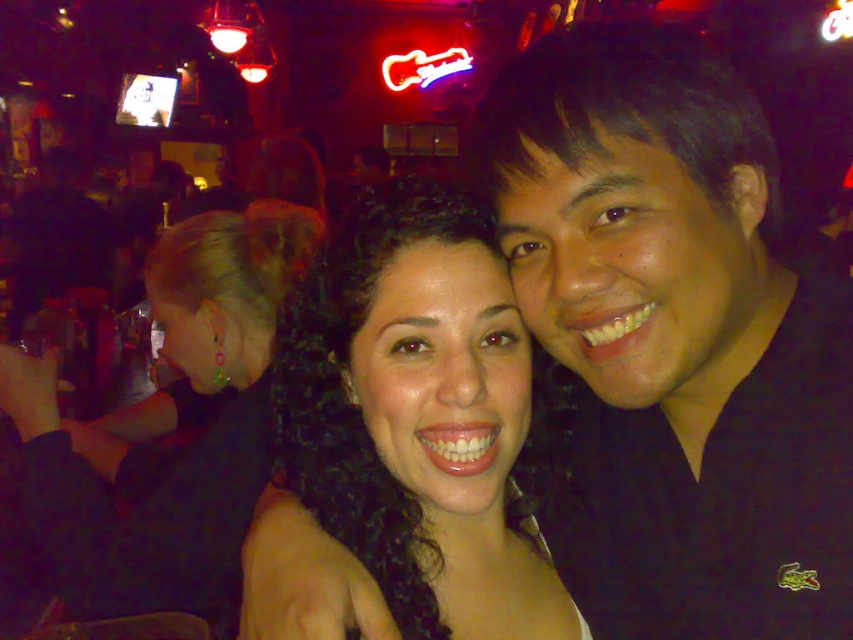
Is black matte shirt at center to the left of satin black dress at upper left from the viewer's perspective?

In fact, black matte shirt at center is to the right of satin black dress at upper left.

Is point (682, 477) closer to viewer compared to point (236, 548)?

Yes, it is.

Image resolution: width=853 pixels, height=640 pixels. I want to click on black matte shirt at center, so click(x=674, y=339).

Where is `black matte shirt at center`? The image size is (853, 640). black matte shirt at center is located at coordinates (674, 339).

The image size is (853, 640). In order to click on black matte shirt at center in this screenshot , I will do `click(674, 339)`.

Is black matte shirt at center positioned in front of matte black hair at center?

That is True.

What do you see at coordinates (674, 339) in the screenshot? I see `black matte shirt at center` at bounding box center [674, 339].

Where is `black matte shirt at center`? The width and height of the screenshot is (853, 640). black matte shirt at center is located at coordinates (674, 339).

Does matte black hair at center appear on the left side of satin black dress at upper left?

Incorrect, matte black hair at center is not on the left side of satin black dress at upper left.

Which is above, matte black hair at center or satin black dress at upper left?

satin black dress at upper left is higher up.

Describe the element at coordinates (418, 417) in the screenshot. The width and height of the screenshot is (853, 640). I see `matte black hair at center` at that location.

This screenshot has height=640, width=853. Find the location of `matte black hair at center`. matte black hair at center is located at coordinates (418, 417).